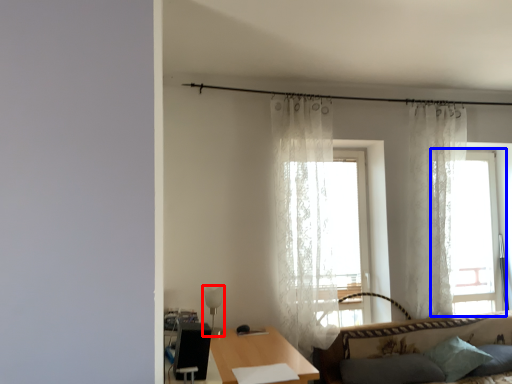
Question: Which of the following is the closest to the observer, lamp (highlighted by a red box) or window (highlighted by a blue box)?

Choices:
 (A) lamp
 (B) window

Answer: (A)